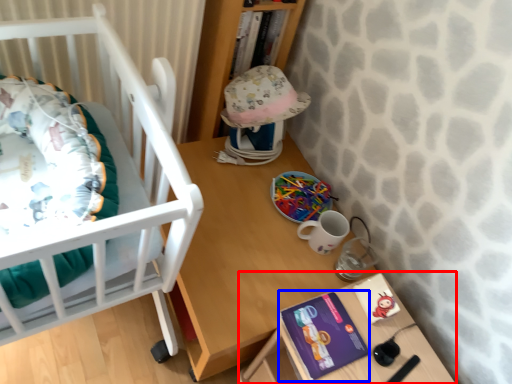
Question: Which object is closer to the camera taking this photo, changing table (highlighted by a red box) or paperback book (highlighted by a blue box)?

Choices:
 (A) changing table
 (B) paperback book

Answer: (A)